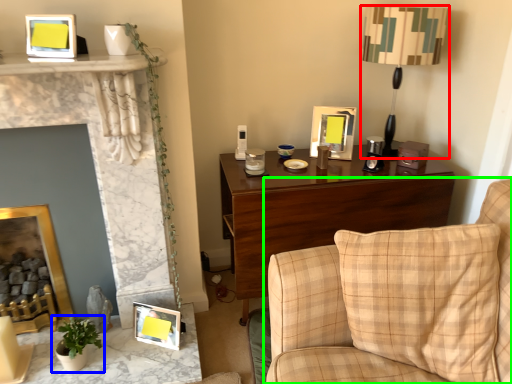
Question: Which object is the closest to the table lamp (highlighted by a red box)? Choose among these: houseplant (highlighted by a blue box) or studio couch (highlighted by a green box).

Choices:
 (A) houseplant
 (B) studio couch

Answer: (B)